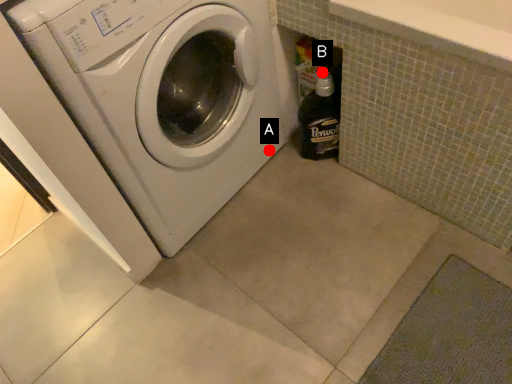
Question: Two points are circled on the image, labeled by A and B beside each circle. Which point is closer to the camera?

Choices:
 (A) A is closer
 (B) B is closer

Answer: (B)